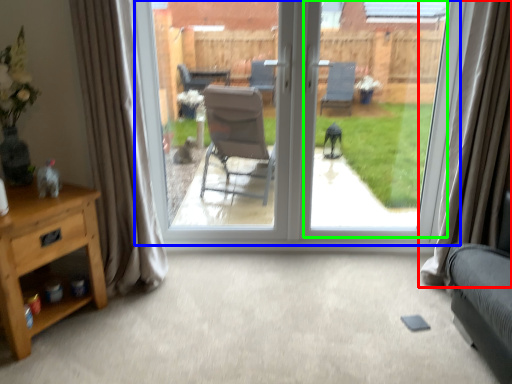
Question: Based on their relative distances, which object is farther from curtain (highlighted by a red box)? Choose from window (highlighted by a blue box) and window screen (highlighted by a green box).

Choices:
 (A) window
 (B) window screen

Answer: (B)